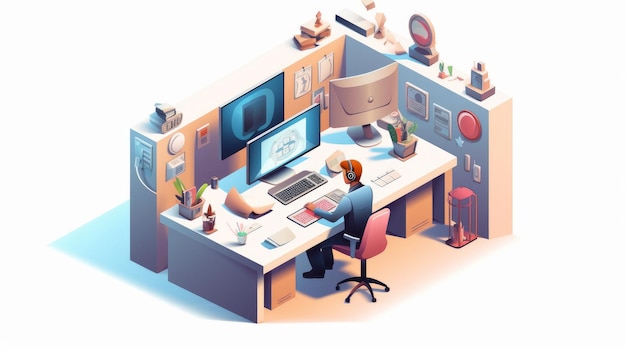
The height and width of the screenshot is (351, 626). I want to click on screen, so click(295, 139), click(249, 111).